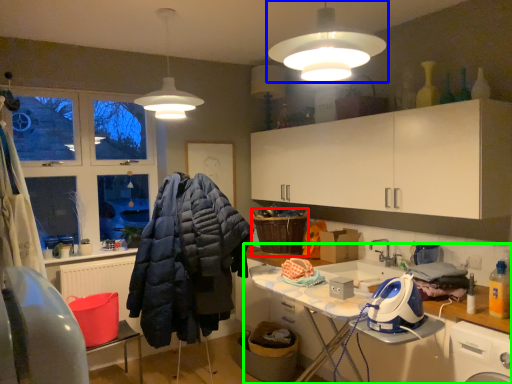
Question: Based on their relative distances, which object is farther from basket (highlighted by a red box)? Choose from lamp (highlighted by a blue box) and countertop (highlighted by a green box).

Choices:
 (A) lamp
 (B) countertop

Answer: (A)